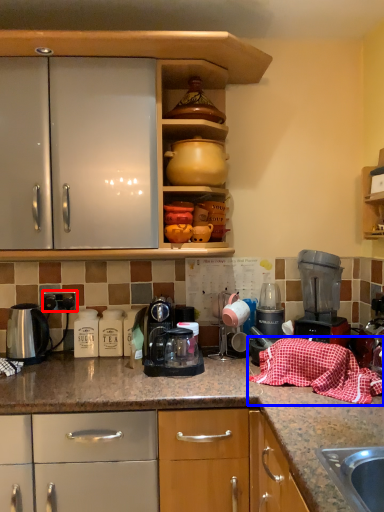
Question: Among these objects, which one is farthest to the camera, electric outlet (highlighted by a red box) or blanket (highlighted by a blue box)?

Choices:
 (A) electric outlet
 (B) blanket

Answer: (A)